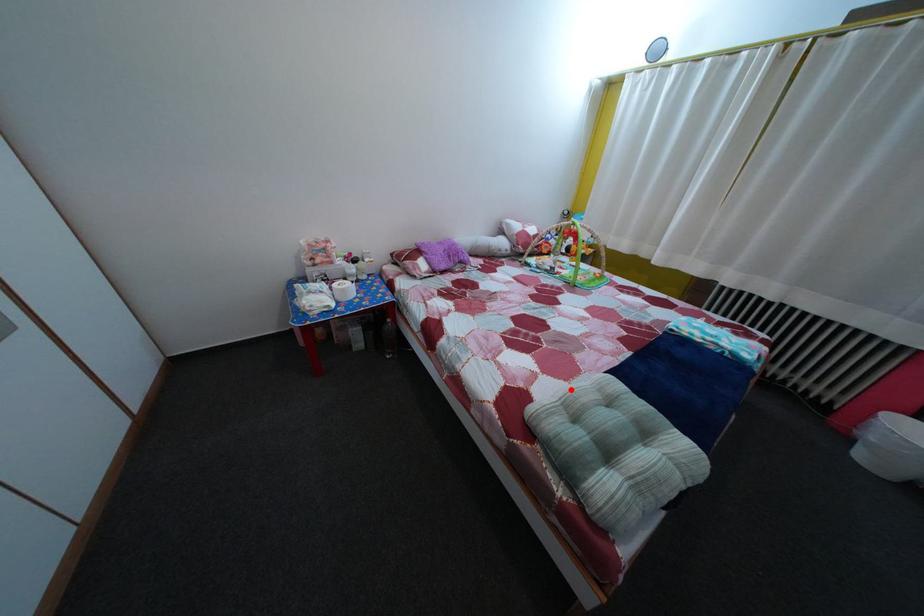
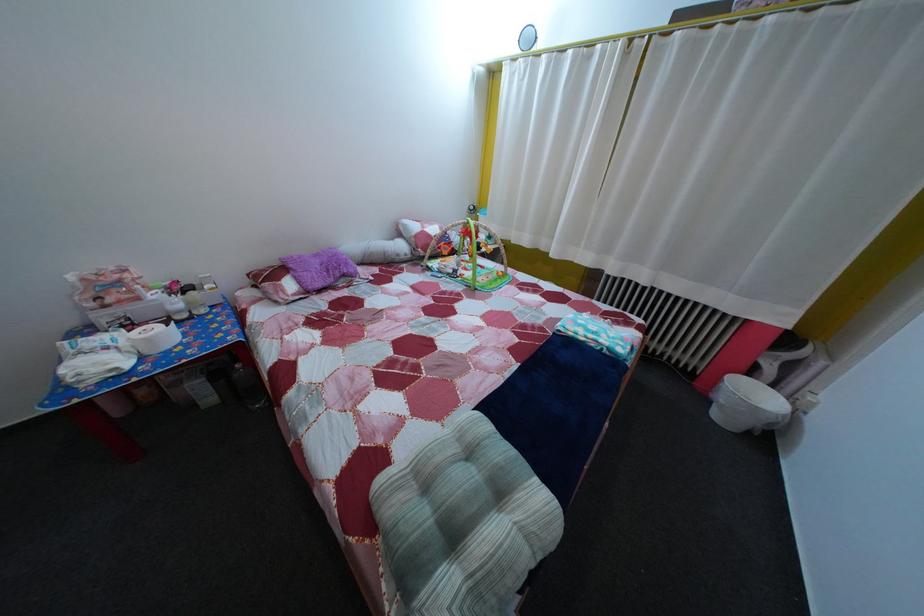
Locate, in the second image, the point that corresponds to the highlighted location in the first image.

(442, 432)